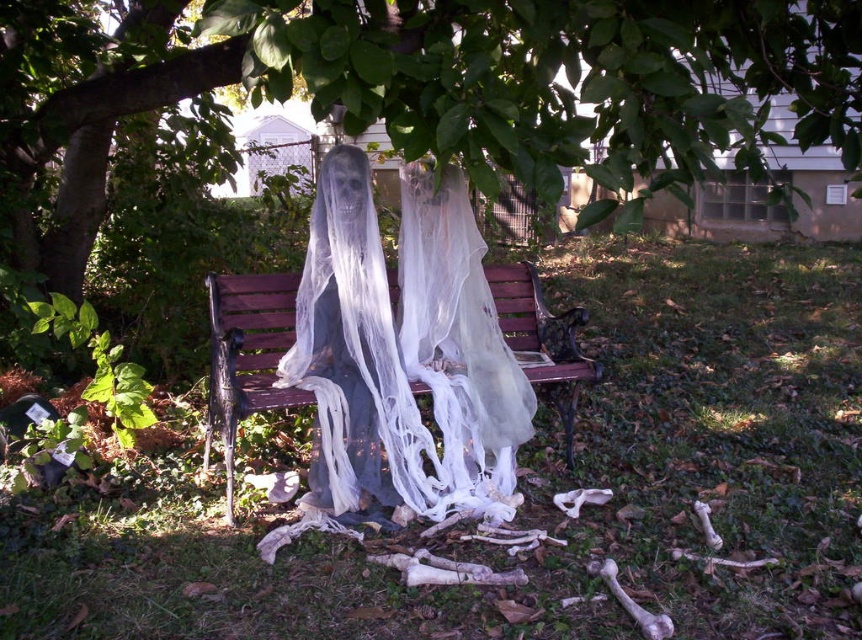
Question: Is the position of green leafy tree at upper center more distant than that of wooden bench at center?

Choices:
 (A) no
 (B) yes

Answer: (A)

Question: Does green leafy tree at upper center appear on the right side of wooden bench at center?

Choices:
 (A) yes
 (B) no

Answer: (A)

Question: Which of the following is the closest to the observer?

Choices:
 (A) wooden bench at center
 (B) green leafy tree at upper center

Answer: (B)

Question: Is green leafy tree at upper center behind wooden bench at center?

Choices:
 (A) yes
 (B) no

Answer: (B)

Question: Which point appears farthest from the camera in this image?

Choices:
 (A) (266, 301)
 (B) (608, 49)

Answer: (A)